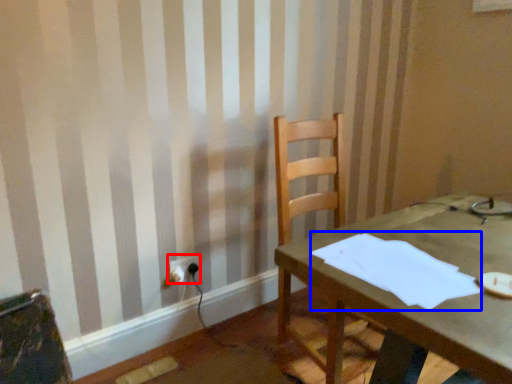
Question: Which object is closer to the camera taking this photo, electric outlet (highlighted by a red box) or paper (highlighted by a blue box)?

Choices:
 (A) electric outlet
 (B) paper

Answer: (B)